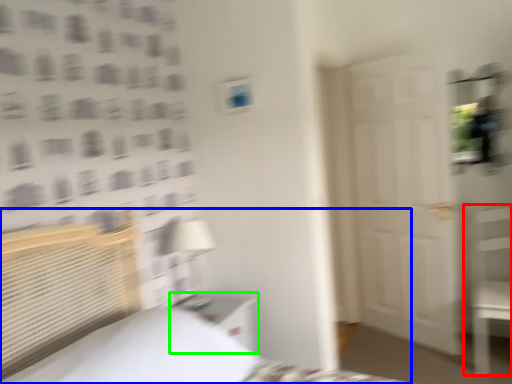
Question: Which object is positioned closest to furniture (highlighted by a red box)? Select from bed (highlighted by a blue box) and nightstand (highlighted by a green box).

Choices:
 (A) bed
 (B) nightstand

Answer: (B)